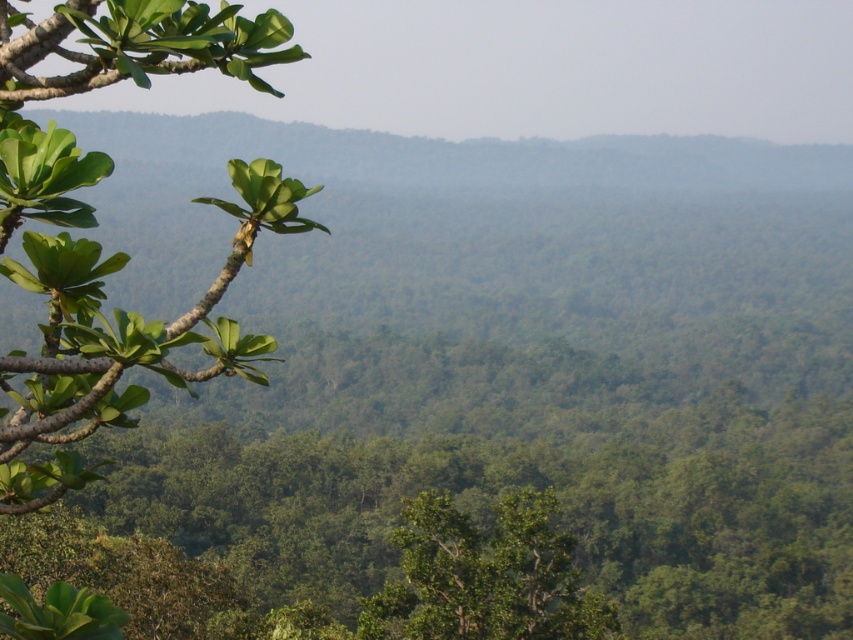
Question: Does green matte leafy branch at left have a smaller size compared to green leafy tree at center?

Choices:
 (A) no
 (B) yes

Answer: (A)

Question: Among these objects, which one is nearest to the camera?

Choices:
 (A) green leafy tree at center
 (B) green matte leafy branch at left

Answer: (B)

Question: Which point is farther from the camera taking this photo?

Choices:
 (A) coord(606,612)
 (B) coord(0,499)

Answer: (A)

Question: Can you confirm if green matte leafy branch at left is positioned below green leafy tree at center?

Choices:
 (A) yes
 (B) no

Answer: (B)

Question: Can you confirm if green matte leafy branch at left is positioned below green leafy tree at center?

Choices:
 (A) yes
 (B) no

Answer: (B)